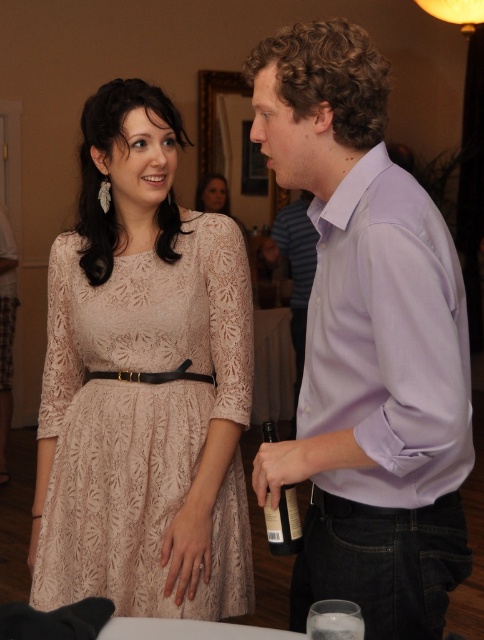
Between lavender cotton shirt at right and lace fabric dress at center, which one appears on the left side from the viewer's perspective?

Positioned to the left is lace fabric dress at center.

Is lavender cotton shirt at right behind lace fabric dress at center?

No, lavender cotton shirt at right is closer to the viewer.

Between point (409, 248) and point (226, 180), which one is positioned in front?

Point (409, 248)

Where is `lavender cotton shirt at right`? This screenshot has height=640, width=484. lavender cotton shirt at right is located at coordinates (367, 346).

From the picture: Can you confirm if purple cotton shirt at center is wider than lace fabric dress at center?

No.

Image resolution: width=484 pixels, height=640 pixels. What do you see at coordinates (295, 272) in the screenshot?
I see `purple cotton shirt at center` at bounding box center [295, 272].

Where is `purple cotton shirt at center`? The image size is (484, 640). purple cotton shirt at center is located at coordinates (295, 272).

Does point (267, 420) come farther from viewer compared to point (225, 214)?

No, (267, 420) is in front of (225, 214).

Looking at this image, which is more to the left, dark brown glass bottle at lower center or lace fabric dress at center?

Positioned to the left is lace fabric dress at center.

Image resolution: width=484 pixels, height=640 pixels. What do you see at coordinates (284, 522) in the screenshot?
I see `dark brown glass bottle at lower center` at bounding box center [284, 522].

You are a GUI agent. You are given a task and a screenshot of the screen. Output one action in this format:
    pyautogui.click(x=<x>, y=<y>)
    Task: Click on the dark brown glass bottle at lower center
    Image resolution: width=484 pixels, height=640 pixels.
    Given the screenshot: What is the action you would take?
    pyautogui.click(x=284, y=522)